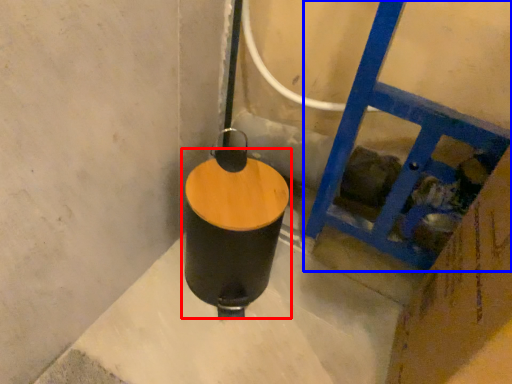
Question: Which object is further to the camera taking this photo, waste container (highlighted by a red box) or ladder (highlighted by a blue box)?

Choices:
 (A) waste container
 (B) ladder

Answer: (A)